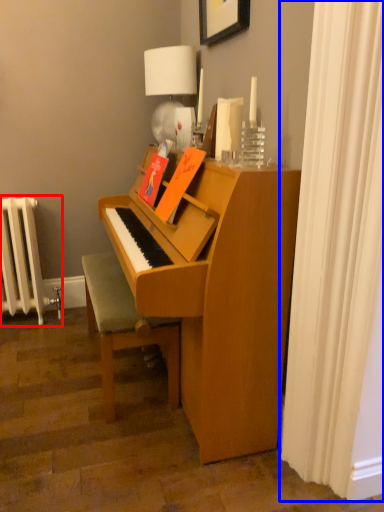
Question: Which object is closer to the camera taking this photo, radiator (highlighted by a red box) or shower curtain (highlighted by a blue box)?

Choices:
 (A) radiator
 (B) shower curtain

Answer: (B)